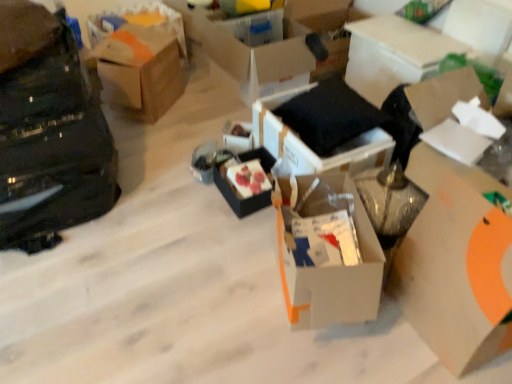
You are a GUI agent. You are given a task and a screenshot of the screen. Output one action in this format:
    pyautogui.click(x=<x>, y=<y>)
    Task: Click on the free space between black matte bag at left and white cardboard box at right, the third box in the right-to-left sequence
    The image size is (512, 384).
    Given the screenshot: What is the action you would take?
    pyautogui.click(x=184, y=246)